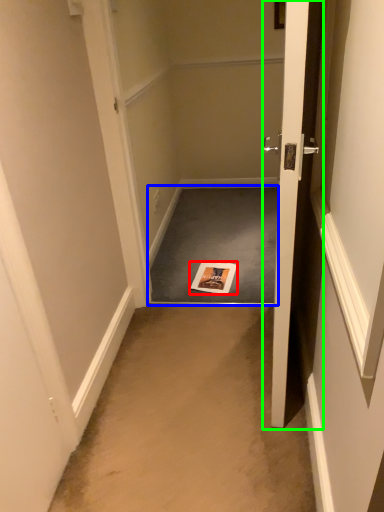
Question: Which object is positioned closest to magazine (highlighted by a red box)? Select from doormat (highlighted by a blue box) and door (highlighted by a green box).

Choices:
 (A) doormat
 (B) door

Answer: (A)